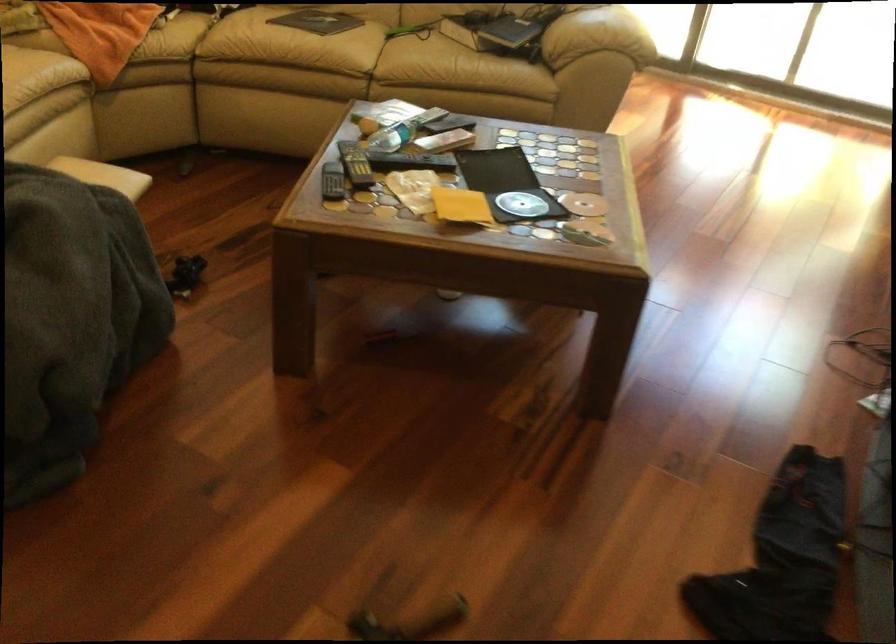
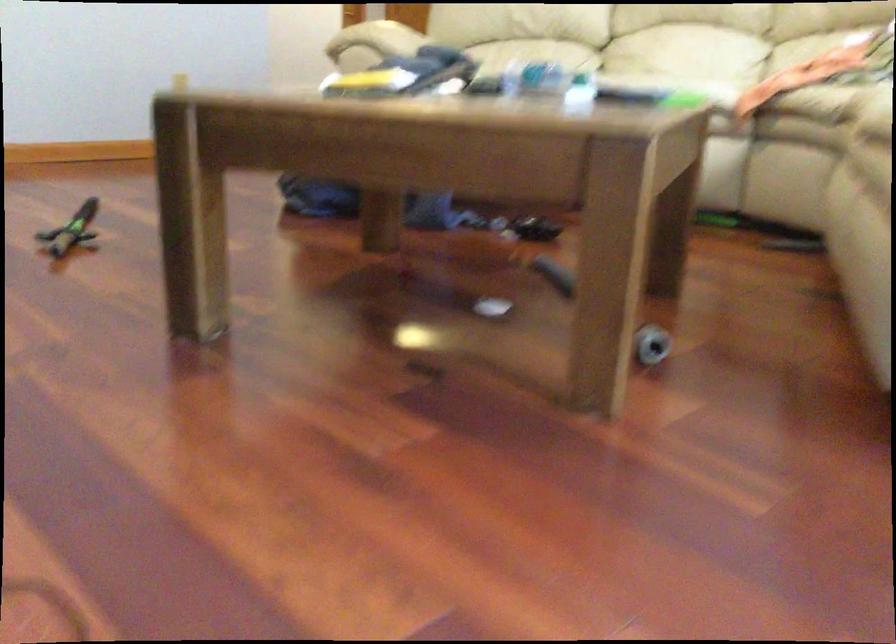
Where in the second image is the point corresponding to (467,129) from the first image?

(580, 93)